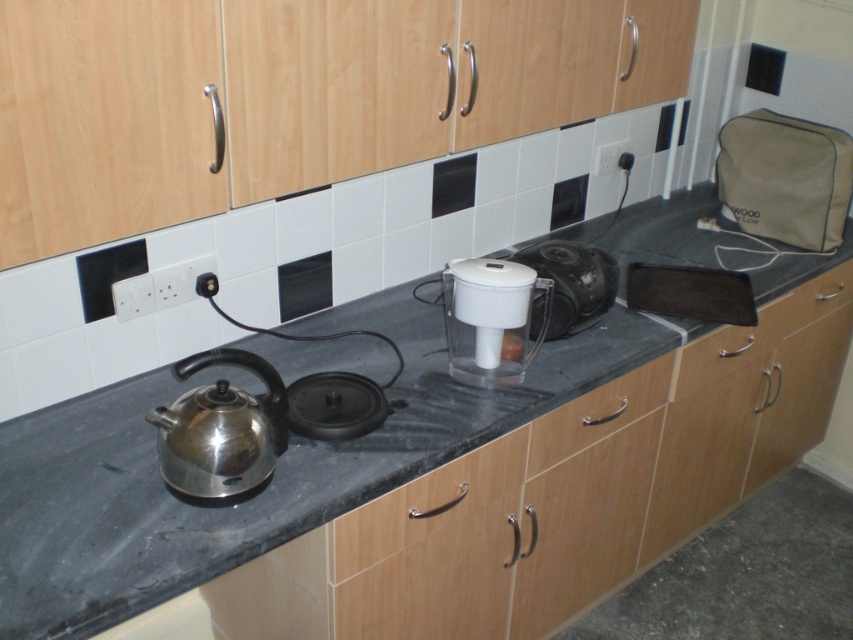
Can you confirm if white plastic water filter at center is positioned to the right of wooden drawer at center?

No, white plastic water filter at center is not to the right of wooden drawer at center.

Between white plastic water filter at center and wooden drawer at center, which one has more height?

white plastic water filter at center is taller.

Who is more forward, (x=498, y=294) or (x=663, y=394)?

Point (x=498, y=294) is in front.

Locate an element on the screen. The height and width of the screenshot is (640, 853). white plastic water filter at center is located at coordinates point(490,317).

Can you confirm if wooden drawer at center is positioned to the left of white plastic toaster at center?

No, wooden drawer at center is not to the left of white plastic toaster at center.

Which of these two, wooden drawer at center or white plastic toaster at center, stands taller?

With more height is wooden drawer at center.

Which is in front, point (535, 449) or point (560, 328)?

Point (535, 449) is in front.

Locate an element on the screen. The image size is (853, 640). wooden drawer at center is located at coordinates (596, 413).

Can you confirm if black granite countertop at center is positioned above white plastic water filter at center?

Actually, black granite countertop at center is below white plastic water filter at center.

Looking at this image, between black granite countertop at center and white plastic water filter at center, which one is positioned higher?

white plastic water filter at center is above.

Image resolution: width=853 pixels, height=640 pixels. What do you see at coordinates (357, 484) in the screenshot?
I see `black granite countertop at center` at bounding box center [357, 484].

At what (x,y) coordinates should I click in order to perform the action: click on black granite countertop at center. Please return your answer as a coordinate pair (x, y). The height and width of the screenshot is (640, 853). Looking at the image, I should click on (357, 484).